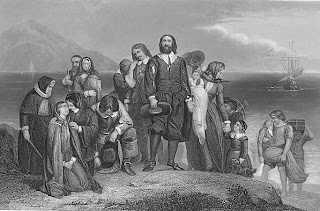
The height and width of the screenshot is (211, 320). In order to click on box in this screenshot , I will do coord(301,124).